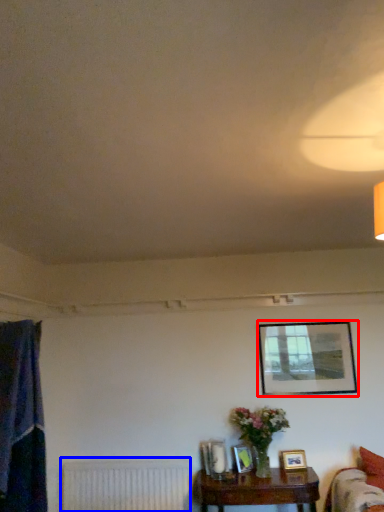
Question: Among these objects, which one is farthest to the camera, picture frame (highlighted by a red box) or radiator (highlighted by a blue box)?

Choices:
 (A) picture frame
 (B) radiator

Answer: (A)